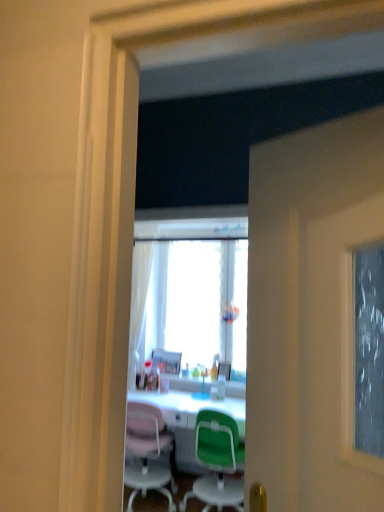
Locate an element on the screen. white glossy desk at center is located at coordinates (189, 420).

The width and height of the screenshot is (384, 512). What do you see at coordinates (224, 370) in the screenshot?
I see `metallic silver picture frame at center, marked as the 1th picture frame in a right-to-left arrangement` at bounding box center [224, 370].

This screenshot has height=512, width=384. Describe the element at coordinates (217, 462) in the screenshot. I see `green plastic chair at center` at that location.

What do you see at coordinates (167, 361) in the screenshot?
I see `matte plastic picture frame at center, the 1th picture frame when ordered from back to front` at bounding box center [167, 361].

Identify the location of translucent plastic bottle at center. (221, 387).

This screenshot has height=512, width=384. In order to click on white glossy desk at center in this screenshot , I will do `click(189, 420)`.

Considering the sizes of objects metallic silver picture frame at center, marked as the 1th picture frame in a right-to-left arrangement, and translucent plastic bottle at center in the image provided, who is wider, metallic silver picture frame at center, marked as the 1th picture frame in a right-to-left arrangement, or translucent plastic bottle at center?

metallic silver picture frame at center, marked as the 1th picture frame in a right-to-left arrangement.

Image resolution: width=384 pixels, height=512 pixels. There is a translucent plastic bottle at center. Find the location of `the 1st picture frame above it (from a real-world perspective)`. the 1st picture frame above it (from a real-world perspective) is located at coordinates (224, 370).

Which is in front, point (228, 369) or point (224, 387)?

Positioned in front is point (224, 387).

From a real-world perspective, which is physically below, metallic silver picture frame at center, the 1th picture frame when ordered from front to back, or translucent plastic bottle at center?

From a 3D spatial view, translucent plastic bottle at center is below.

Is white glossy desk at center turned away from green plastic chair at center?

No, green plastic chair at center is not at the back of white glossy desk at center.

Can you confirm if white glossy desk at center is positioned to the left of green plastic chair at center?

Correct, you'll find white glossy desk at center to the left of green plastic chair at center.

Can you tell me how much white glossy desk at center and green plastic chair at center differ in facing direction?

The angular difference between white glossy desk at center and green plastic chair at center is 178 degrees.

Is white glossy desk at center oriented away from transparent glass window at center?

white glossy desk at center does not have its back to transparent glass window at center.

Does white glossy desk at center have a lesser width compared to transparent glass window at center?

In fact, white glossy desk at center might be wider than transparent glass window at center.

Is white glossy desk at center bigger or smaller than transparent glass window at center?

Clearly, white glossy desk at center is larger in size than transparent glass window at center.

Is white glossy desk at center directly adjacent to transparent glass window at center?

No, white glossy desk at center is not beside transparent glass window at center.

Is transparent glass window at center located outside white glossy desk at center?

transparent glass window at center is positioned outside white glossy desk at center.

Which is behind, point (221, 301) or point (177, 428)?

Point (221, 301)

Could you tell me if transparent glass window at center is turned towards white glossy desk at center?

No.

From a real-world perspective, is transparent glass window at center above or below white glossy desk at center?

transparent glass window at center is above white glossy desk at center.

From the image's perspective, is green plastic chair at center beneath translucent plastic bottle at center?

Yes, from the image's perspective, green plastic chair at center is below translucent plastic bottle at center.

Would you say translucent plastic bottle at center is part of green plastic chair at center's contents?

Definitely not — translucent plastic bottle at center is not inside green plastic chair at center.

How far apart are green plastic chair at center and translucent plastic bottle at center?

green plastic chair at center and translucent plastic bottle at center are 27.33 inches apart.

Which object is positioned more to the right, green plastic chair at center or translucent plastic bottle at center?

translucent plastic bottle at center is more to the right.

Would you say matte plastic picture frame at center, the second picture frame viewed from the front, contains translucent plastic bottle at center?

No, translucent plastic bottle at center is not surrounded by matte plastic picture frame at center, the second picture frame viewed from the front.

Considering the relative positions of matte plastic picture frame at center, the second picture frame viewed from the front, and translucent plastic bottle at center in the image provided, is matte plastic picture frame at center, the second picture frame viewed from the front, to the left of translucent plastic bottle at center from the viewer's perspective?

Correct, you'll find matte plastic picture frame at center, the second picture frame viewed from the front, to the left of translucent plastic bottle at center.

Considering the positions of points (163, 362) and (219, 398), is point (163, 362) closer to camera compared to point (219, 398)?

No, (163, 362) is behind (219, 398).

Locate an element on the screen. The image size is (384, 512). desk below the green plastic chair at center (from the image's perspective) is located at coordinates (189, 420).

How different are the orientations of green plastic chair at center and white glossy desk at center in degrees?

There is a 178-degree angle between the facing directions of green plastic chair at center and white glossy desk at center.

Is point (212, 422) closer to camera compared to point (165, 396)?

Yes, point (212, 422) is closer to viewer.

Identify the location of bottle located in front of the metallic silver picture frame at center, which is the 2th picture frame in left-to-right order. (221, 387).

Where is `chair above the white glossy desk at center (from the image's perspective)`? chair above the white glossy desk at center (from the image's perspective) is located at coordinates coord(217,462).

From the image, which object appears to be nearer to white glossy desk at center, green plastic chair at center or translucent plastic bottle at center?

green plastic chair at center.

Looking at this image, from the image, which object appears to be farther from transparent glass window at center, metallic silver picture frame at center, marked as the 1th picture frame in a right-to-left arrangement, or translucent plastic bottle at center?

Based on the image, translucent plastic bottle at center appears to be further to transparent glass window at center.

Looking at this image, when comparing their distances from white glossy desk at center, does transparent glass window at center or matte plastic picture frame at center, the 2th picture frame in the right-to-left sequence, seem closer?

matte plastic picture frame at center, the 2th picture frame in the right-to-left sequence.

Considering their positions, is transparent glass window at center positioned further to matte plastic picture frame at center, the first picture frame from the left, than translucent plastic bottle at center?

The object further to matte plastic picture frame at center, the first picture frame from the left, is translucent plastic bottle at center.

Based on their spatial positions, is metallic silver picture frame at center, which is the 2th picture frame from back to front, or white glossy desk at center closer to matte plastic picture frame at center, the 1th picture frame when ordered from back to front?

metallic silver picture frame at center, which is the 2th picture frame from back to front, is closer to matte plastic picture frame at center, the 1th picture frame when ordered from back to front.

When comparing their distances from matte plastic picture frame at center, the 2th picture frame in the right-to-left sequence, does translucent plastic bottle at center or transparent glass window at center seem further?

translucent plastic bottle at center lies further to matte plastic picture frame at center, the 2th picture frame in the right-to-left sequence, than the other object.

When comparing their distances from metallic silver picture frame at center, which is the 2th picture frame in left-to-right order, does green plastic chair at center or white glossy desk at center seem closer?

white glossy desk at center is closer to metallic silver picture frame at center, which is the 2th picture frame in left-to-right order.

Considering their positions, is matte plastic picture frame at center, the second picture frame viewed from the front, positioned closer to metallic silver picture frame at center, which is the 2th picture frame in left-to-right order, than translucent plastic bottle at center?

translucent plastic bottle at center is positioned closer to the anchor metallic silver picture frame at center, which is the 2th picture frame in left-to-right order.

Locate an element on the screen. The image size is (384, 512). chair between transparent glass window at center and matte plastic picture frame at center, the first picture frame from the left, in the front-back direction is located at coordinates (217, 462).

Image resolution: width=384 pixels, height=512 pixels. Identify the location of desk between green plastic chair at center and translucent plastic bottle at center from front to back. (189, 420).

The width and height of the screenshot is (384, 512). Identify the location of desk between transparent glass window at center and translucent plastic bottle at center from front to back. (189, 420).

Where is `picture frame positioned between white glossy desk at center and matte plastic picture frame at center, the first picture frame from the left, from near to far`? This screenshot has width=384, height=512. picture frame positioned between white glossy desk at center and matte plastic picture frame at center, the first picture frame from the left, from near to far is located at coordinates (224, 370).